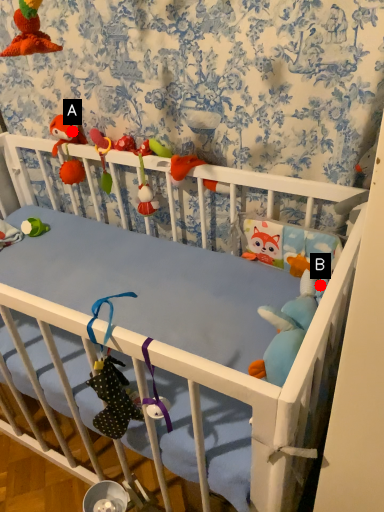
Question: Two points are circled on the image, labeled by A and B beside each circle. Which point appears farthest from the camera in this image?

Choices:
 (A) A is further
 (B) B is further

Answer: (A)